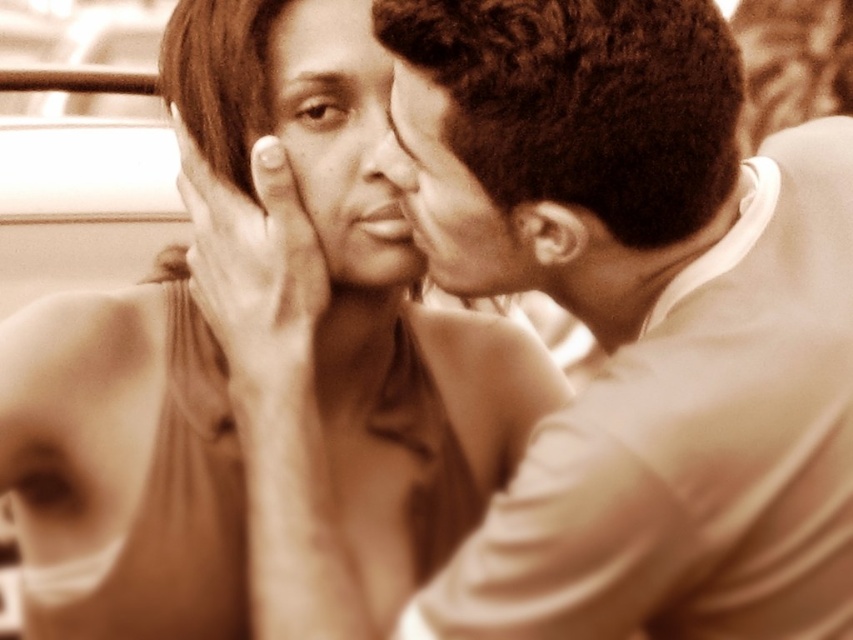
Can you confirm if smooth beige dress at center is positioned to the right of smooth skin face at upper right?

Incorrect, smooth beige dress at center is not on the right side of smooth skin face at upper right.

Is point (466, 362) farther from camera compared to point (410, 86)?

Yes.

The image size is (853, 640). I want to click on smooth beige dress at center, so click(x=364, y=305).

Can you confirm if smooth skin face at center is positioned to the left of smooth skin hand at center?

No, smooth skin face at center is not to the left of smooth skin hand at center.

Does point (344, 186) lie behind point (267, 340)?

No, (344, 186) is closer to viewer.

Who is more distant from viewer, (398, 216) or (311, 312)?

Point (311, 312)

Find the location of a particular element. Image resolution: width=853 pixels, height=640 pixels. smooth skin face at center is located at coordinates (x=339, y=138).

Which is more to the right, smooth skin hand at center or smooth skin face at upper right?

Positioned to the right is smooth skin face at upper right.

The image size is (853, 640). I want to click on smooth skin hand at center, so click(x=254, y=266).